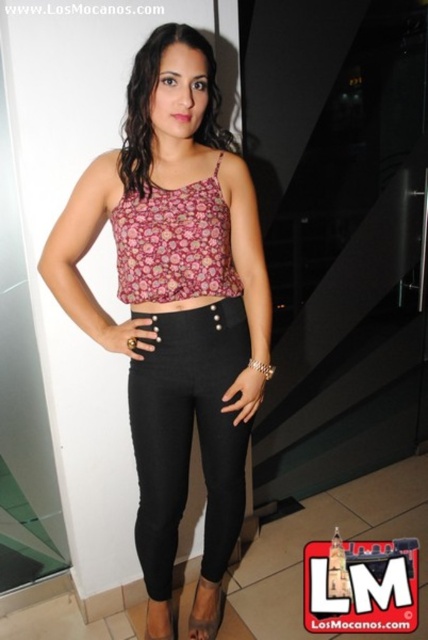
Question: Which point is closer to the camera?

Choices:
 (A) black leather sandal at lower center
 (B) floral fabric top at center

Answer: (B)

Question: Considering the relative positions of floral-patterned fabric crop top at center and black leather sandal at lower center in the image provided, where is floral-patterned fabric crop top at center located with respect to black leather sandal at lower center?

Choices:
 (A) above
 (B) below

Answer: (A)

Question: Can you confirm if floral fabric top at center is wider than floral-patterned fabric crop top at center?

Choices:
 (A) no
 (B) yes

Answer: (B)

Question: Which object is closer to the camera taking this photo?

Choices:
 (A) black leather sandal at lower center
 (B) leather sandal at lower center
 (C) floral-patterned fabric crop top at center
 (D) floral fabric top at center

Answer: (D)

Question: Based on their relative distances, which object is nearer to the floral fabric top at center?

Choices:
 (A) leather sandal at lower center
 (B) black leather sandal at lower center
 (C) floral-patterned fabric crop top at center

Answer: (C)

Question: Is floral fabric top at center to the right of leather sandal at lower center from the viewer's perspective?

Choices:
 (A) no
 (B) yes

Answer: (A)